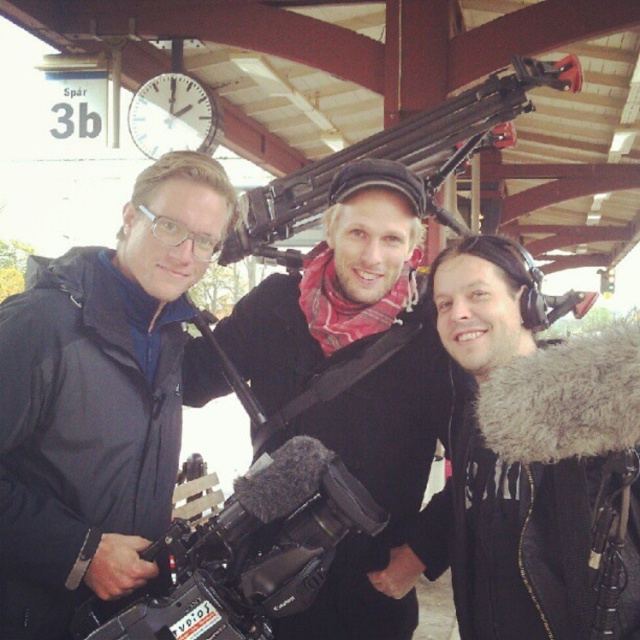
You are standing at the train station platform on Sp?r 3b. You need to place a 20 feet long banner between the black matte camera at center and the camera. Will the banner fit between them?

The distance between the black matte camera at center and the camera is 19.67 feet, so the 20 feet long banner will not fit between them as it is slightly longer than the available space.

Consider the image. You are a security officer at the train station. You notice two objects at the center of the platform, a black matte camera and a matte black machine gun. According to safety protocols, any weapon must be at least 5 feet away from all other objects. Is the distance between the matte black machine gun at center and the black matte camera at center compliant with the safety protocols?

The distance between the black matte camera at center and the matte black machine gun at center is 4.01 feet, which is less than the required 5 feet. Therefore, it does not comply with the safety protocols.